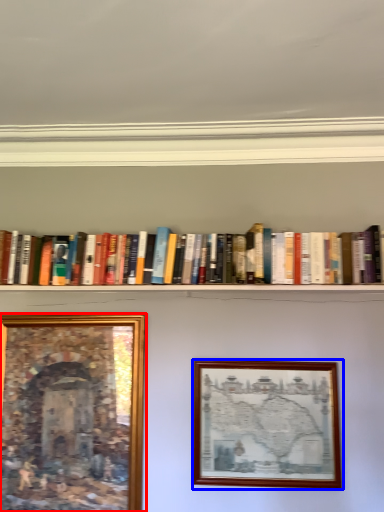
Question: Which object appears farthest to the camera in this image, picture frame (highlighted by a red box) or picture frame (highlighted by a blue box)?

Choices:
 (A) picture frame
 (B) picture frame

Answer: (A)